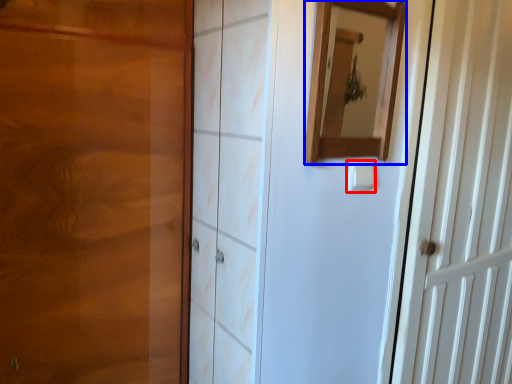
Question: Which of the following is the farthest to the observer, light switch (highlighted by a red box) or mirror (highlighted by a blue box)?

Choices:
 (A) light switch
 (B) mirror

Answer: (A)